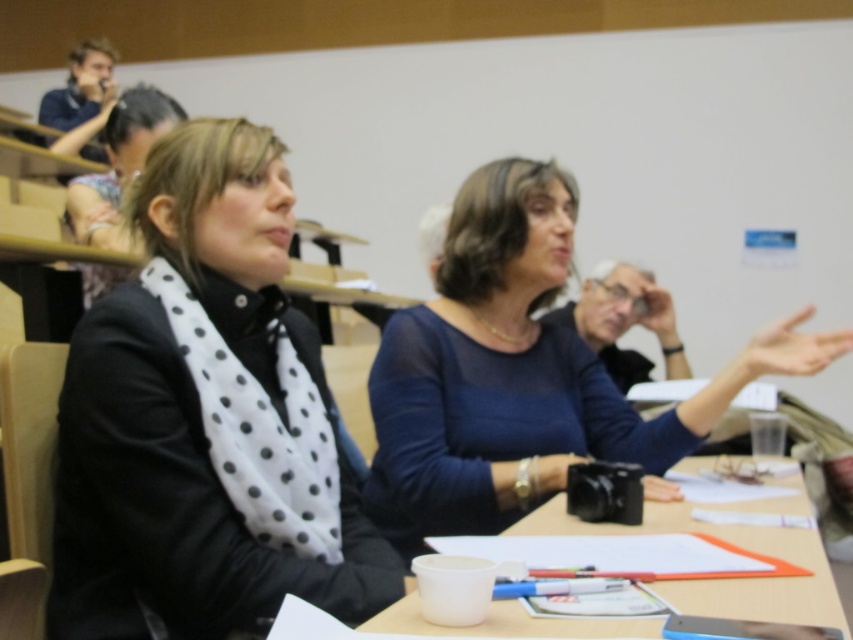
Question: Is blue sheer blouse at center wider than white plastic cup at lower center?

Choices:
 (A) no
 (B) yes

Answer: (A)

Question: Does white dotted scarf at center appear on the right side of blue sheer blouse at center?

Choices:
 (A) yes
 (B) no

Answer: (B)

Question: Which point is closer to the camera taking this photo?

Choices:
 (A) (440, 508)
 (B) (144, 492)

Answer: (B)

Question: Does white dotted scarf at center have a smaller size compared to white plastic cup at lower center?

Choices:
 (A) no
 (B) yes

Answer: (A)

Question: Which point is farther to the camera?

Choices:
 (A) (497, 388)
 (B) (247, 570)
 (C) (686, 529)

Answer: (A)

Question: Estimate the real-world distances between objects in this image. Which object is farther from the white dotted scarf at center?

Choices:
 (A) blue sheer blouse at center
 (B) white plastic cup at lower center

Answer: (B)